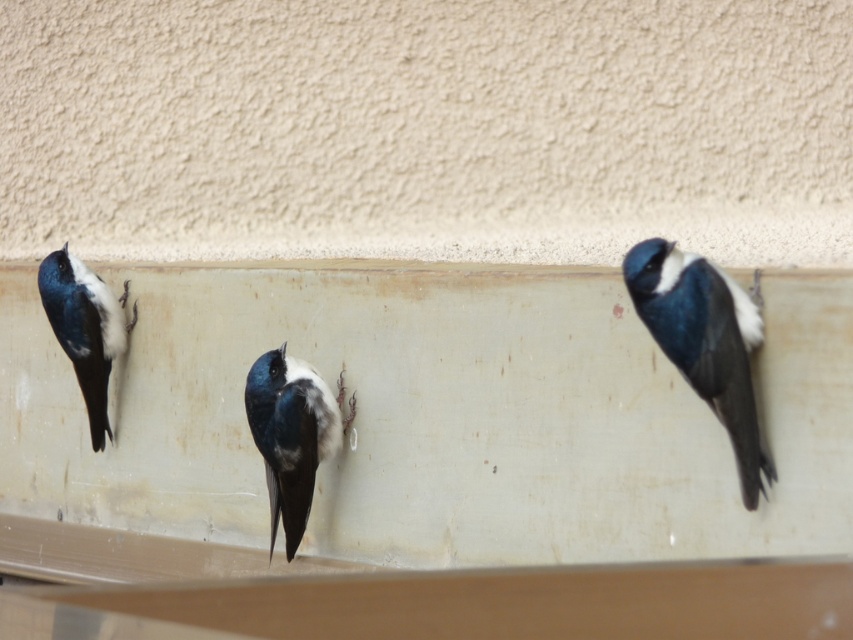
You are a birdwatcher observing three swallows on a ledge. You notice a shiny blue bird at right and a blue glossy swallow at center. Which of these two birds has a greater width?

The shiny blue bird at right has a greater width than the blue glossy swallow at center because the shiny blue bird at right surpasses the blue glossy swallow at center in width.

You are standing in front of the ledge where the birds are perched. Which bird, the blue glossy swallow at center or the shiny blue and white bird at left, is positioned closer to you?

The blue glossy swallow at center is closer to the viewer than the shiny blue and white bird at left.

You are a birdwatcher observing the scene. You notice two birds on the ledge. Which bird has a wider body, the shiny blue bird at right or the shiny blue and white bird at left?

The shiny blue bird at right might be wider than the shiny blue and white bird at left.